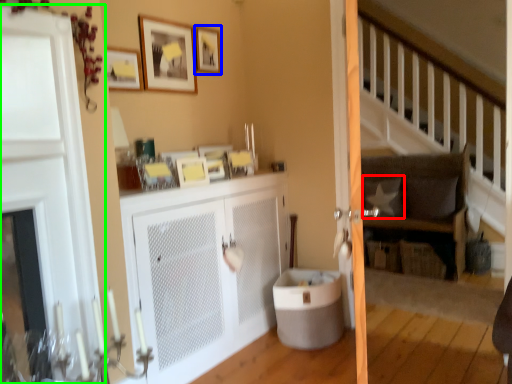
Question: Which object is positioned closest to pillow (highlighted by a red box)? Select from picture frame (highlighted by a blue box) and door (highlighted by a green box).

Choices:
 (A) picture frame
 (B) door

Answer: (A)